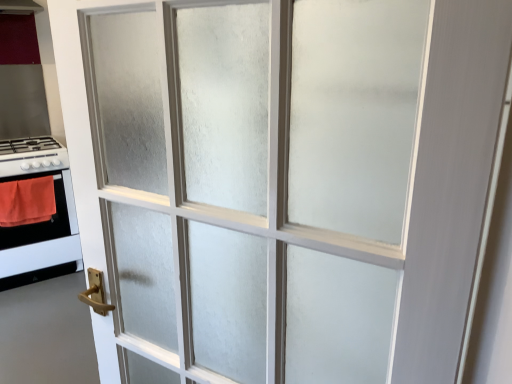
Question: Does orange fabric at left lie behind white glossy gas stove at left?

Choices:
 (A) yes
 (B) no

Answer: (B)

Question: Can you confirm if orange fabric at left is wider than white glossy gas stove at left?

Choices:
 (A) yes
 (B) no

Answer: (B)

Question: Is orange fabric at left at the left side of white glossy gas stove at left?

Choices:
 (A) yes
 (B) no

Answer: (B)

Question: Does orange fabric at left have a smaller size compared to white glossy gas stove at left?

Choices:
 (A) yes
 (B) no

Answer: (A)

Question: Is orange fabric at left turned away from white glossy gas stove at left?

Choices:
 (A) yes
 (B) no

Answer: (A)

Question: Considering the positions of orange fabric at left and wooden handle at lower left in the image, is orange fabric at left bigger or smaller than wooden handle at lower left?

Choices:
 (A) big
 (B) small

Answer: (B)

Question: In terms of height, does orange fabric at left look taller or shorter compared to wooden handle at lower left?

Choices:
 (A) short
 (B) tall

Answer: (B)

Question: In the image, is orange fabric at left on the left side or the right side of wooden handle at lower left?

Choices:
 (A) right
 (B) left

Answer: (B)

Question: Does point (3, 226) appear closer or farther from the camera than point (20, 377)?

Choices:
 (A) farther
 (B) closer

Answer: (A)

Question: Is point (30, 163) positioned closer to the camera than point (27, 183)?

Choices:
 (A) farther
 (B) closer

Answer: (B)

Question: Considering the positions of white glossy stove at left and orange fabric at left in the image, is white glossy stove at left taller or shorter than orange fabric at left?

Choices:
 (A) short
 (B) tall

Answer: (B)

Question: From the image's perspective, is white glossy stove at left positioned above or below orange fabric at left?

Choices:
 (A) above
 (B) below

Answer: (B)

Question: Do you think white glossy stove at left is within orange fabric at left, or outside of it?

Choices:
 (A) outside
 (B) inside

Answer: (A)

Question: Based on their sizes in the image, would you say wooden handle at lower left is bigger or smaller than orange fabric at left?

Choices:
 (A) small
 (B) big

Answer: (B)

Question: Relative to orange fabric at left, is wooden handle at lower left in front or behind?

Choices:
 (A) front
 (B) behind

Answer: (A)